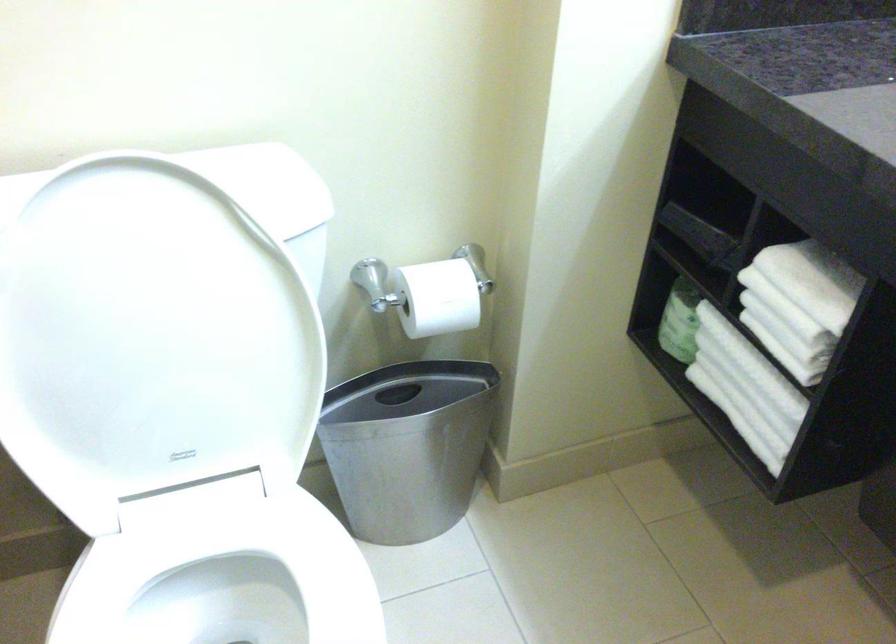
Where would you lift the white toilet seat? Please return your answer as a coordinate pair (x, y).

(225, 581)